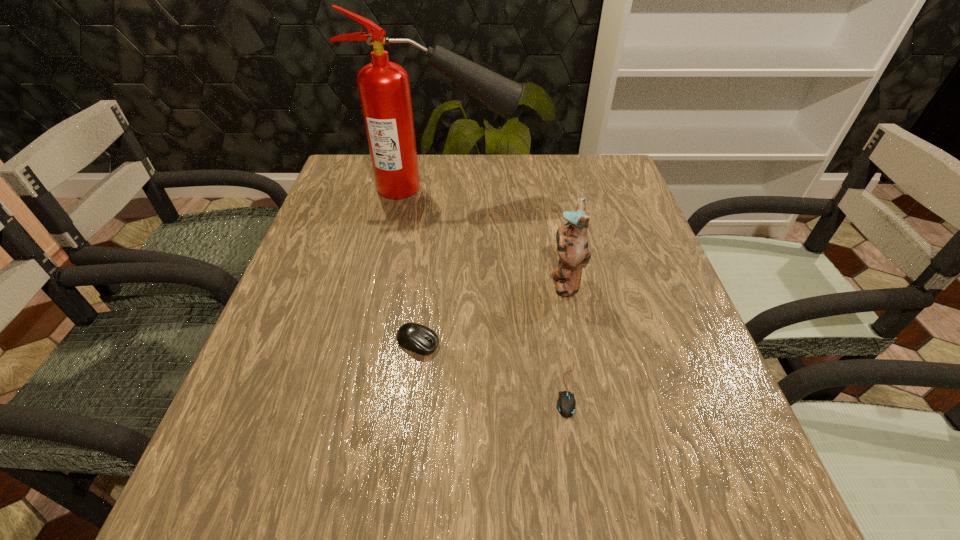
The height and width of the screenshot is (540, 960). Find the location of `the tallest object`. the tallest object is located at coordinates (384, 89).

Locate an element on the screen. Image resolution: width=960 pixels, height=540 pixels. fire extinguisher is located at coordinates (384, 89).

Where is `the second farthest object`? The height and width of the screenshot is (540, 960). the second farthest object is located at coordinates (572, 242).

Image resolution: width=960 pixels, height=540 pixels. What are the coordinates of `figurine` in the screenshot? It's located at (572, 242).

Image resolution: width=960 pixels, height=540 pixels. Identify the location of the second nearest object. (420, 339).

The width and height of the screenshot is (960, 540). In order to click on the taller mouse in this screenshot , I will do coord(420,339).

This screenshot has width=960, height=540. In order to click on the shortest object in this screenshot , I will do `click(566, 403)`.

Where is `the right mouse`? the right mouse is located at coordinates (566, 403).

Find the location of a particular element. vacant space located at the nozzle of the tallest object is located at coordinates (540, 188).

I want to click on blank space located 0.080m on the front-facing side of the figurine, so click(x=513, y=281).